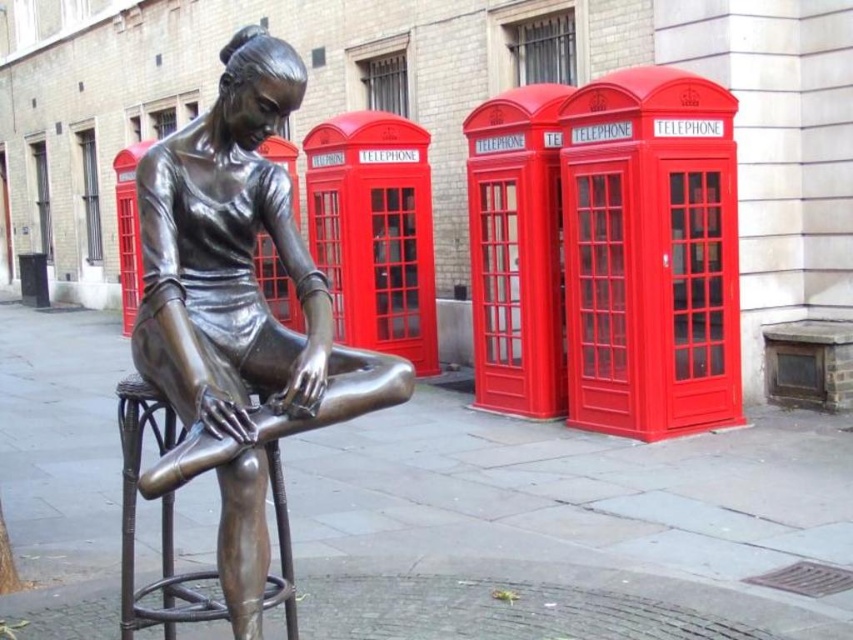
Question: Does bronze statue at center appear on the right side of bronze textured bar stool at center?

Choices:
 (A) yes
 (B) no

Answer: (A)

Question: Which of the following is the farthest from the observer?

Choices:
 (A) (212, 173)
 (B) (285, 547)

Answer: (B)

Question: Does bronze statue at center have a larger size compared to bronze textured bar stool at center?

Choices:
 (A) no
 (B) yes

Answer: (A)

Question: Is bronze statue at center wider than bronze textured bar stool at center?

Choices:
 (A) no
 (B) yes

Answer: (B)